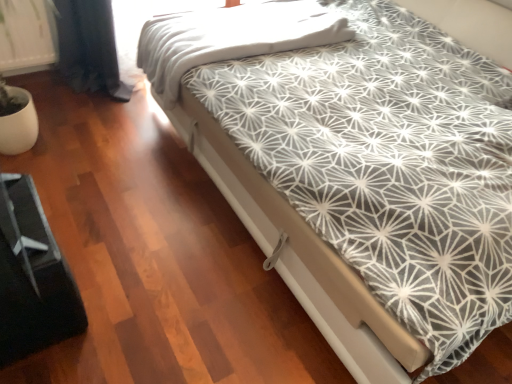
Question: Considering the relative sizes of black plastic bed frame at lower left and white textured blanket at upper center in the image provided, is black plastic bed frame at lower left taller than white textured blanket at upper center?

Choices:
 (A) yes
 (B) no

Answer: (A)

Question: Considering the relative positions of black plastic bed frame at lower left and white textured blanket at upper center in the image provided, is black plastic bed frame at lower left in front of white textured blanket at upper center?

Choices:
 (A) no
 (B) yes

Answer: (B)

Question: Can you confirm if black plastic bed frame at lower left is smaller than white textured blanket at upper center?

Choices:
 (A) no
 (B) yes

Answer: (B)

Question: From a real-world perspective, is black plastic bed frame at lower left over white textured blanket at upper center?

Choices:
 (A) yes
 (B) no

Answer: (B)

Question: From the image's perspective, is black plastic bed frame at lower left over white textured blanket at upper center?

Choices:
 (A) yes
 (B) no

Answer: (B)

Question: From the image's perspective, is black plastic bed frame at lower left located beneath white textured blanket at upper center?

Choices:
 (A) yes
 (B) no

Answer: (A)

Question: Can you confirm if white textured blanket at upper center is positioned to the left of white geometric-patterned bed at center?

Choices:
 (A) yes
 (B) no

Answer: (A)

Question: Can you confirm if white textured blanket at upper center is shorter than white geometric-patterned bed at center?

Choices:
 (A) yes
 (B) no

Answer: (A)

Question: From a real-world perspective, is white textured blanket at upper center below white geometric-patterned bed at center?

Choices:
 (A) no
 (B) yes

Answer: (B)

Question: Can you confirm if white textured blanket at upper center is smaller than white geometric-patterned bed at center?

Choices:
 (A) yes
 (B) no

Answer: (A)

Question: Are white textured blanket at upper center and white geometric-patterned bed at center located far from each other?

Choices:
 (A) yes
 (B) no

Answer: (B)

Question: Is white textured blanket at upper center looking in the opposite direction of white geometric-patterned bed at center?

Choices:
 (A) yes
 (B) no

Answer: (A)

Question: Is black plastic bed frame at lower left not within white geometric-patterned bed at center?

Choices:
 (A) no
 (B) yes

Answer: (B)